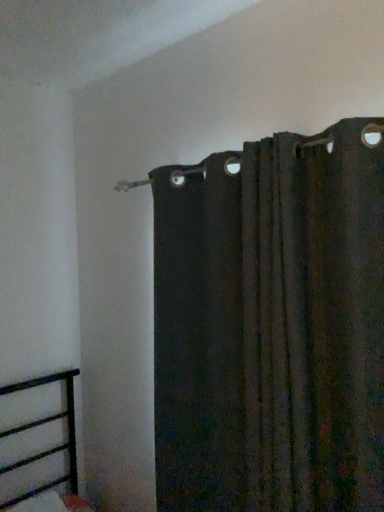
Locate an element on the screen. This screenshot has height=512, width=384. dark fabric curtain at upper right is located at coordinates (272, 325).

The width and height of the screenshot is (384, 512). What do you see at coordinates (272, 325) in the screenshot? I see `dark fabric curtain at upper right` at bounding box center [272, 325].

Locate an element on the screen. The image size is (384, 512). dark fabric curtain at upper right is located at coordinates (272, 325).